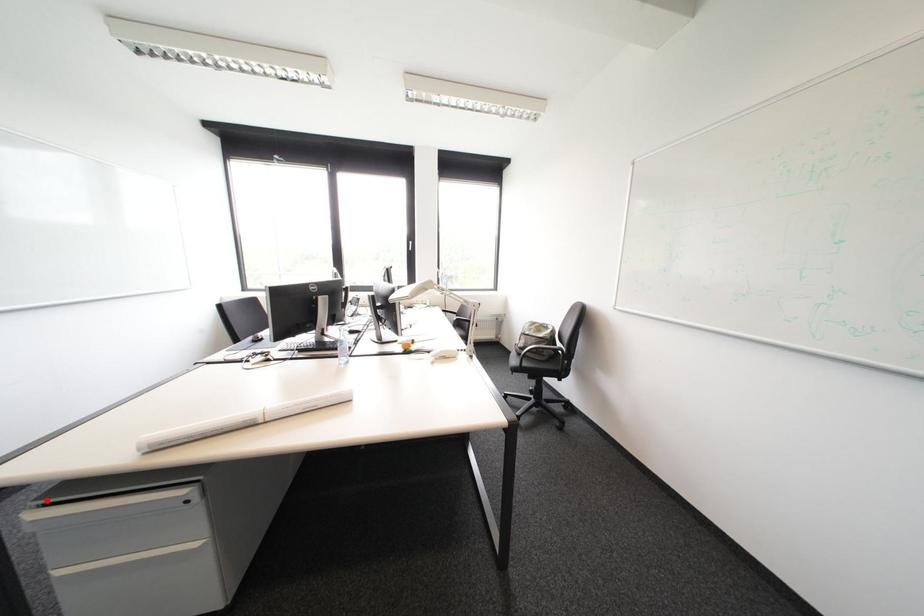
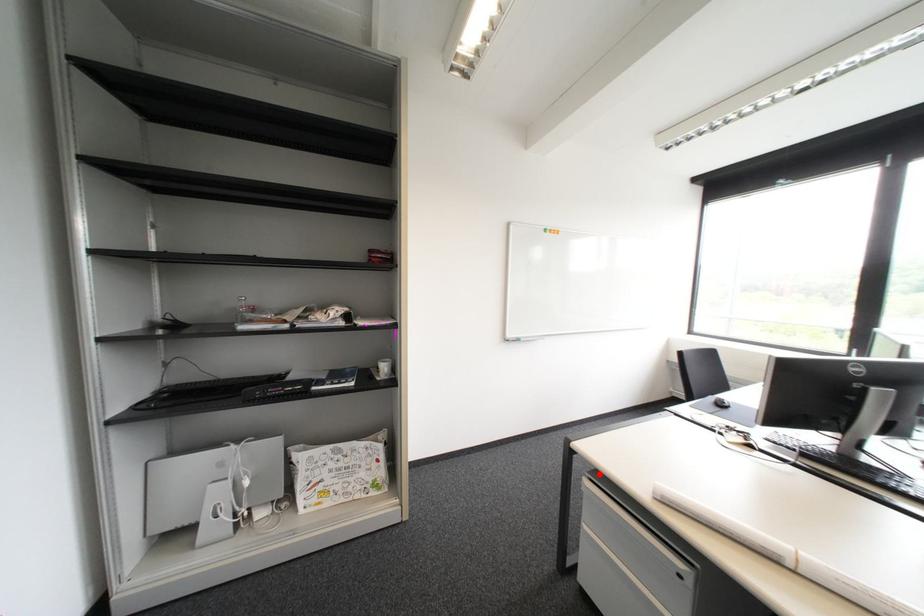
I am providing you with two images of the same scene from different viewpoints. A red point is marked on the first image and another point is marked on the second image. Is the red point in image1 aligned with the point shown in image2?

Yes